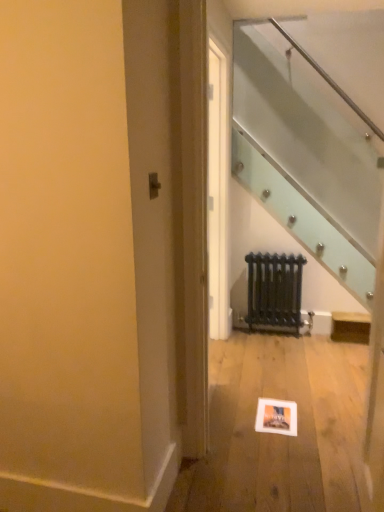
Where is `free space in front of matte orange picture frame at lower center`? free space in front of matte orange picture frame at lower center is located at coordinates (284, 439).